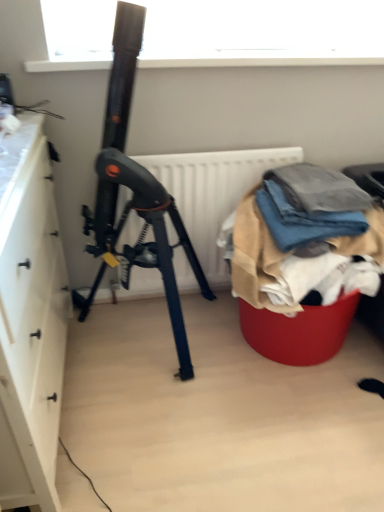
This screenshot has height=512, width=384. I want to click on free space above denim fabric at right (from a real-world perspective), so click(311, 185).